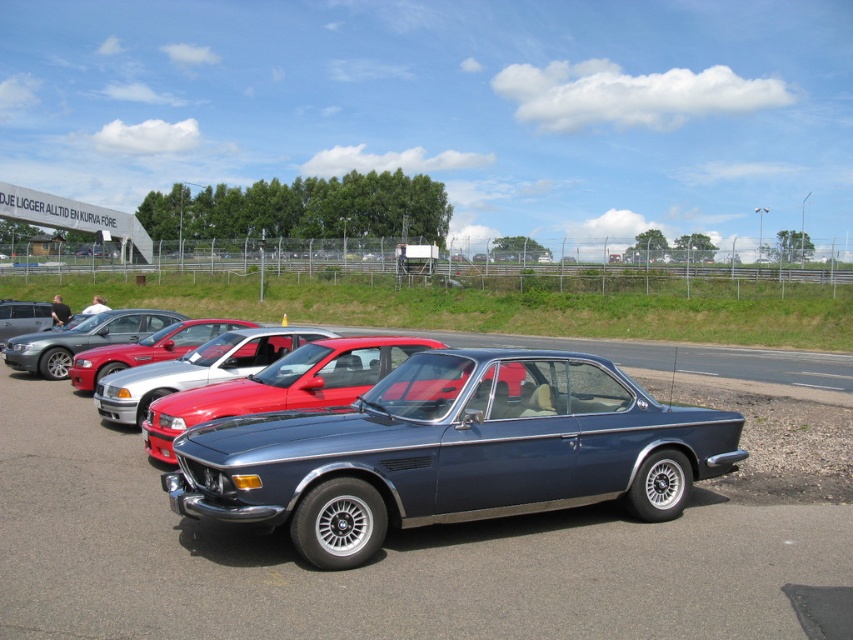
Question: Observing the image, what is the correct spatial positioning of shiny red car at center in reference to satin silver car at center?

Choices:
 (A) left
 (B) right

Answer: (B)

Question: Based on their relative distances, which object is nearer to the glossy metallic car at center?

Choices:
 (A) silver metallic sedan at center
 (B) shiny red car at center
 (C) metallic blue car at center

Answer: (C)

Question: Does metallic blue car at center appear under satin silver car at center?

Choices:
 (A) no
 (B) yes

Answer: (B)

Question: Does metallic blue car at center appear under satin blue car at center?

Choices:
 (A) yes
 (B) no

Answer: (A)

Question: Among these objects, which one is nearest to the camera?

Choices:
 (A) metallic blue car at center
 (B) shiny red car at center

Answer: (A)

Question: Which object is positioned closest to the glossy metallic car at center?

Choices:
 (A) metallic blue car at center
 (B) satin blue car at center

Answer: (A)